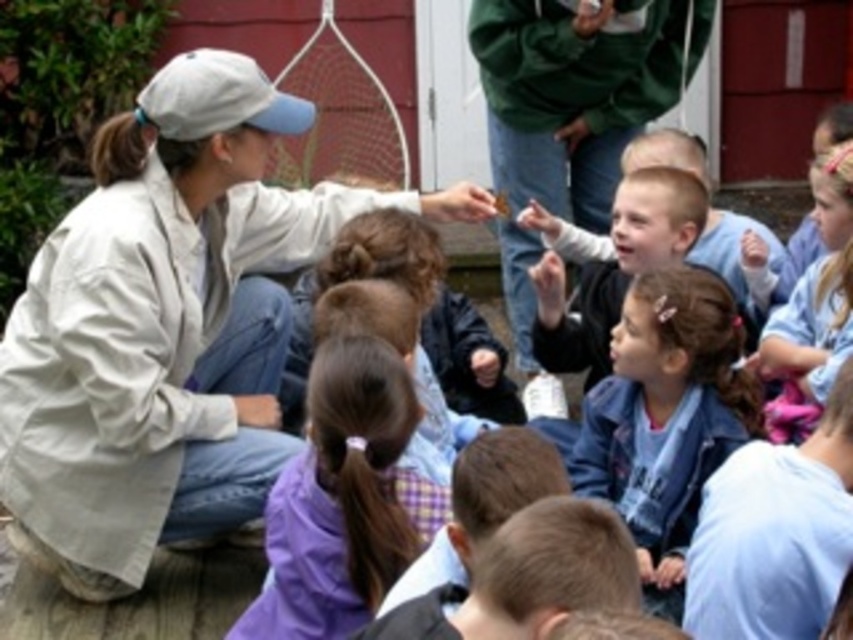
You are a photographer trying to capture a clear shot of both the green matte jacket at upper center and the purple plaid shirt at center. Since you want to ensure both are visible, which one should you focus on first to avoid blurring?

You should focus on the green matte jacket at upper center first because the purple plaid shirt at center is behind it, so focusing on the front object ensures clarity before adjusting for the one behind.